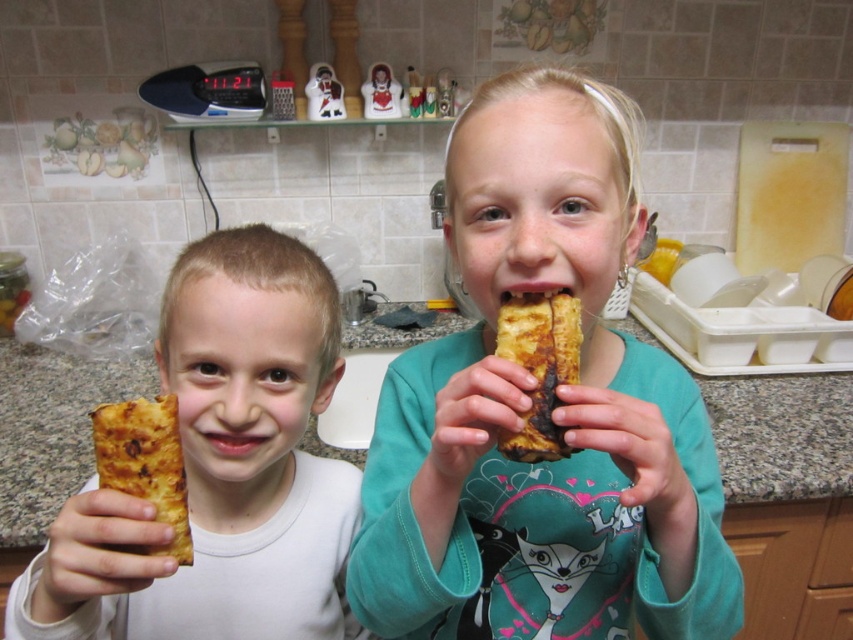
Question: Which point appears farthest from the camera in this image?

Choices:
 (A) (640, 227)
 (B) (572, 314)

Answer: (A)

Question: Which of the following is the farthest from the observer?

Choices:
 (A) (119, 476)
 (B) (305, 508)

Answer: (B)

Question: From the image, what is the correct spatial relationship of matte golden bread at center in relation to golden-brown flaky pastry at center?

Choices:
 (A) below
 (B) above

Answer: (B)

Question: Can you confirm if golden-brown flaky pastry at left is positioned below golden brown crispy bread at center?

Choices:
 (A) yes
 (B) no

Answer: (A)

Question: Is granite countertop at center to the right of golden-brown flaky pastry at left from the viewer's perspective?

Choices:
 (A) no
 (B) yes

Answer: (A)

Question: Which object is closer to the camera taking this photo?

Choices:
 (A) matte golden bread at center
 (B) golden brown crispy bread at center
 (C) golden-brown flaky pastry at center
 (D) granite countertop at center

Answer: (C)